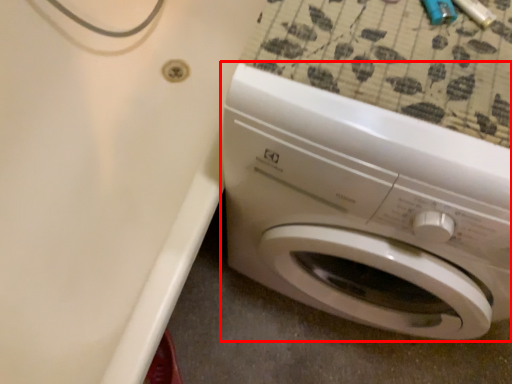
Question: In this image, where is washing machine (annotated by the red box) located relative to bath?

Choices:
 (A) right
 (B) left

Answer: (A)